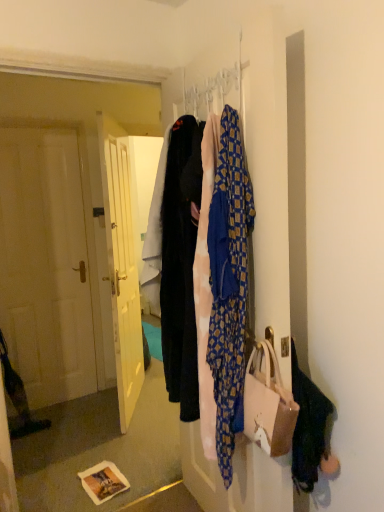
Question: Does metallic silver hanger at upper center appear on the right side of blue patterned fabric at center?

Choices:
 (A) no
 (B) yes

Answer: (A)

Question: Considering the relative sizes of metallic silver hanger at upper center and blue patterned fabric at center in the image provided, is metallic silver hanger at upper center smaller than blue patterned fabric at center?

Choices:
 (A) no
 (B) yes

Answer: (B)

Question: From the image's perspective, is metallic silver hanger at upper center beneath blue patterned fabric at center?

Choices:
 (A) yes
 (B) no

Answer: (B)

Question: Is the surface of metallic silver hanger at upper center in direct contact with blue patterned fabric at center?

Choices:
 (A) no
 (B) yes

Answer: (A)

Question: Is blue patterned fabric at center surrounded by metallic silver hanger at upper center?

Choices:
 (A) no
 (B) yes

Answer: (A)

Question: Considering the positions of point (183, 91) and point (182, 193), is point (183, 91) closer or farther from the camera than point (182, 193)?

Choices:
 (A) farther
 (B) closer

Answer: (A)

Question: Considering the positions of metallic silver hanger at upper center and velvet black pants at center in the image, is metallic silver hanger at upper center bigger or smaller than velvet black pants at center?

Choices:
 (A) big
 (B) small

Answer: (B)

Question: From the image's perspective, is metallic silver hanger at upper center located above or below velvet black pants at center?

Choices:
 (A) below
 (B) above

Answer: (B)

Question: Based on their positions, is metallic silver hanger at upper center located to the left or right of velvet black pants at center?

Choices:
 (A) right
 (B) left

Answer: (A)

Question: In terms of size, does metallic silver hanger at upper center appear bigger or smaller than blue patterned fabric at center?

Choices:
 (A) big
 (B) small

Answer: (B)

Question: Is metallic silver hanger at upper center spatially inside blue patterned fabric at center, or outside of it?

Choices:
 (A) outside
 (B) inside

Answer: (A)

Question: Considering the positions of metallic silver hanger at upper center and blue patterned fabric at center in the image, is metallic silver hanger at upper center taller or shorter than blue patterned fabric at center?

Choices:
 (A) tall
 (B) short

Answer: (B)

Question: Based on their positions, is metallic silver hanger at upper center located to the left or right of blue patterned fabric at center?

Choices:
 (A) right
 (B) left

Answer: (B)

Question: Is blue patterned fabric at center spatially inside metallic silver hanger at upper center, or outside of it?

Choices:
 (A) outside
 (B) inside

Answer: (A)

Question: Does point (228, 417) appear closer or farther from the camera than point (226, 80)?

Choices:
 (A) closer
 (B) farther

Answer: (A)